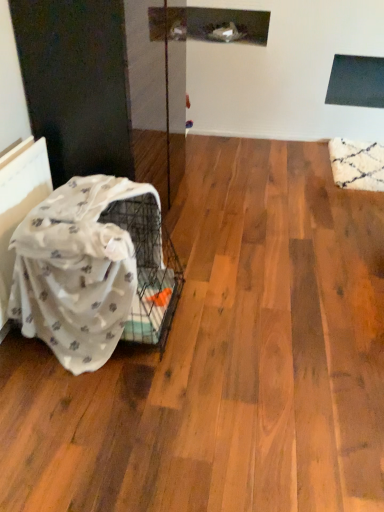
This screenshot has height=512, width=384. I want to click on spots to the right of white fleece blanket at left, so click(x=229, y=322).